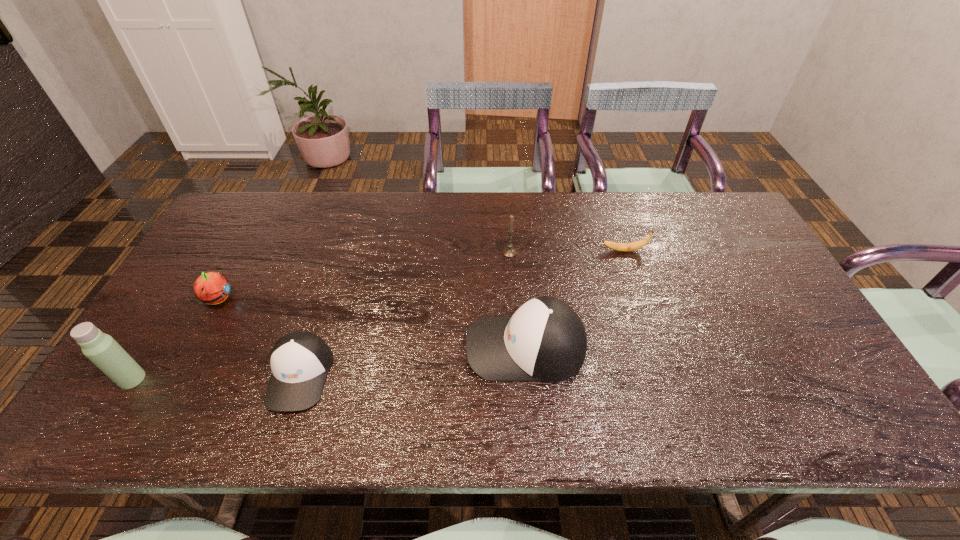
Locate an element on the screen. This screenshot has height=540, width=960. free space that satisfies the following two spatial constraints: 1. on the peel of the rightmost object from the top; 2. on the front panel of the third object from left to right is located at coordinates (665, 375).

Identify the location of free space in the image that satisfies the following two spatial constraints: 1. on the peel of the banana from the top; 2. on the front panel of the shorter cap. The width and height of the screenshot is (960, 540). (665, 375).